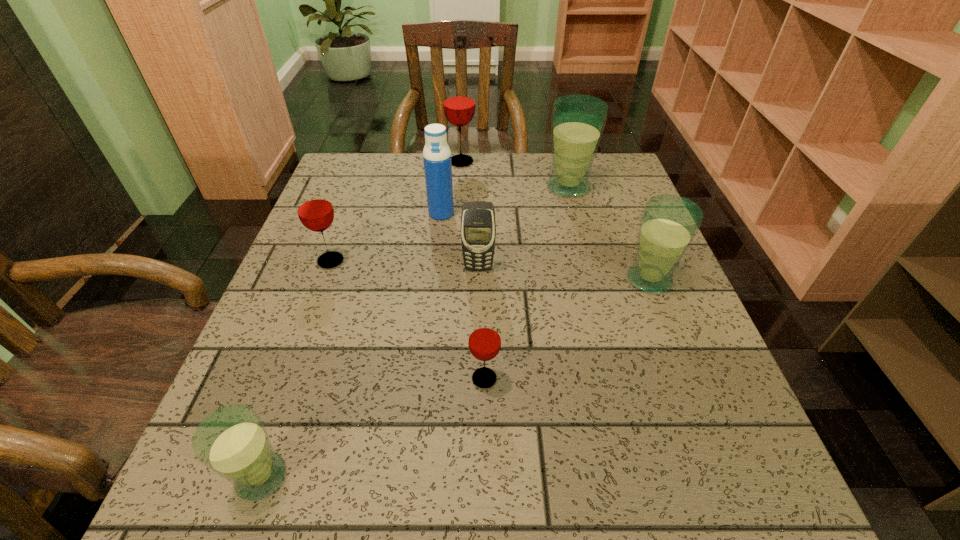
Select which object is the closest to the nearest red glass. Please provide its 2D coordinates. Your answer should be formatted as a tuple, i.e. [(x, y)], where the tuple contains the x and y coordinates of a point satisfying the conditions above.

[(478, 228)]

Image resolution: width=960 pixels, height=540 pixels. In order to click on the closest glass to the second farthest blue glass in this screenshot , I will do `click(577, 121)`.

The height and width of the screenshot is (540, 960). I want to click on glass that can be found as the fifth closest to the second smallest blue glass, so click(232, 441).

In order to click on red glass object that ranks as the closest to the nearest object in this screenshot , I will do `click(484, 341)`.

Locate an element on the screen. The image size is (960, 540). the closest red glass to the rightmost blue glass is located at coordinates (484, 341).

Point out which blue glass is positioned as the second nearest to the nearest red glass. Please provide its 2D coordinates. Your answer should be formatted as a tuple, i.e. [(x, y)], where the tuple contains the x and y coordinates of a point satisfying the conditions above.

[(669, 223)]

At what (x,y) coordinates should I click in order to perform the action: click on blue glass that is the second closest to the nearest glass. Please return your answer as a coordinate pair (x, y). Image resolution: width=960 pixels, height=540 pixels. Looking at the image, I should click on (577, 121).

Find the location of `free spot that satisfies the following two spatial constraints: 1. on the back side of the second smallest blue glass; 2. on the right side of the nearest object`. free spot that satisfies the following two spatial constraints: 1. on the back side of the second smallest blue glass; 2. on the right side of the nearest object is located at coordinates (330, 280).

Identify the location of vacant space that satisfies the following two spatial constraints: 1. on the back side of the biggest red glass; 2. on the left side of the third farthest object. (446, 161).

This screenshot has width=960, height=540. Find the location of `vacant space that satisfies the following two spatial constraints: 1. on the front face of the second smallest blue glass; 2. on the left side of the cellular telephone`. vacant space that satisfies the following two spatial constraints: 1. on the front face of the second smallest blue glass; 2. on the left side of the cellular telephone is located at coordinates (478, 280).